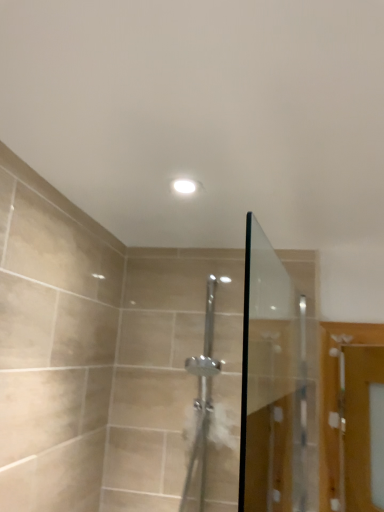
Find the location of a particular element. This screenshot has width=384, height=512. transparent glass door at center is located at coordinates (278, 381).

The height and width of the screenshot is (512, 384). What do you see at coordinates (278, 381) in the screenshot?
I see `transparent glass door at center` at bounding box center [278, 381].

Image resolution: width=384 pixels, height=512 pixels. In order to click on transparent glass door at center in this screenshot , I will do `click(278, 381)`.